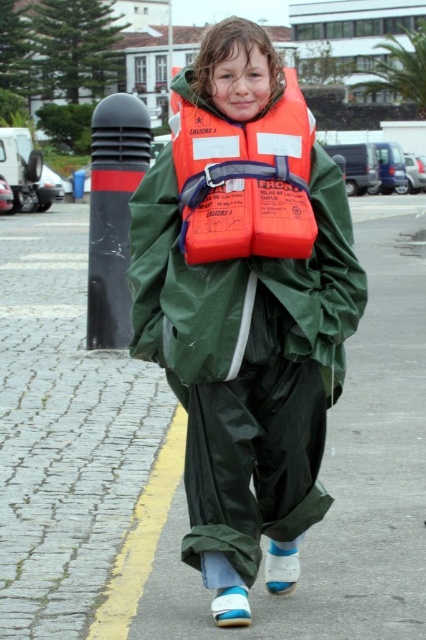
Does brick paved road at center appear on the left side of orange matte life jacket at center?

Correct, you'll find brick paved road at center to the left of orange matte life jacket at center.

Which is below, brick paved road at center or orange matte life jacket at center?

brick paved road at center is below.

Is point (0, 420) farther from camera compared to point (250, 141)?

Yes.

Where is `brick paved road at center`? This screenshot has height=640, width=426. brick paved road at center is located at coordinates (181, 460).

Between orange life vest at center and orange matte life jacket at center, which one is positioned lower?

Positioned lower is orange life vest at center.

Does orange life vest at center appear under orange matte life jacket at center?

Yes, orange life vest at center is below orange matte life jacket at center.

What do you see at coordinates (245, 307) in the screenshot?
I see `orange life vest at center` at bounding box center [245, 307].

Where is `orange life vest at center`? orange life vest at center is located at coordinates (245, 307).

Measure the distance between point (26, 557) and camera.

A distance of 12.09 feet exists between point (26, 557) and camera.

This screenshot has width=426, height=640. I want to click on brick paved road at center, so (x=181, y=460).